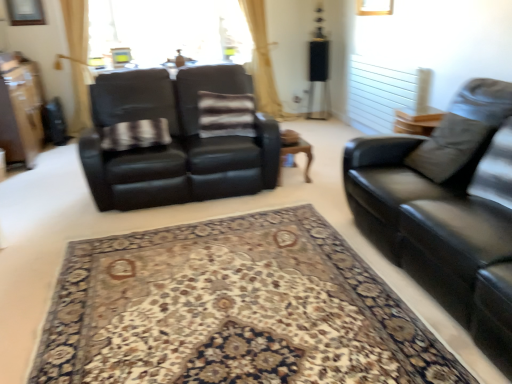
Question: Considering the positions of point (384, 188) and point (152, 34), is point (384, 188) closer or farther from the camera than point (152, 34)?

Choices:
 (A) farther
 (B) closer

Answer: (B)

Question: Considering the positions of black leather couch at right, which is counted as the 2th studio couch, starting from the left, and transparent glass window screen at upper center in the image, is black leather couch at right, which is counted as the 2th studio couch, starting from the left, bigger or smaller than transparent glass window screen at upper center?

Choices:
 (A) small
 (B) big

Answer: (B)

Question: Which of these objects is positioned closest to the wooden coffee table at center?

Choices:
 (A) matte brown dresser at left
 (B) carpeted rug at center
 (C) black leather couch at right, the 1th studio couch positioned from the right
 (D) black leather couch at left, which appears as the first studio couch when viewed from the left
 (E) plaid fabric at center

Answer: (D)

Question: Estimate the real-world distances between objects in this image. Which object is farther from the plaid fabric at center?

Choices:
 (A) matte brown dresser at left
 (B) striped fabric pillow at center
 (C) carpeted rug at center
 (D) black leather couch at right, placed as the 1th studio couch when sorted from front to back
 (E) transparent glass window screen at upper center

Answer: (E)